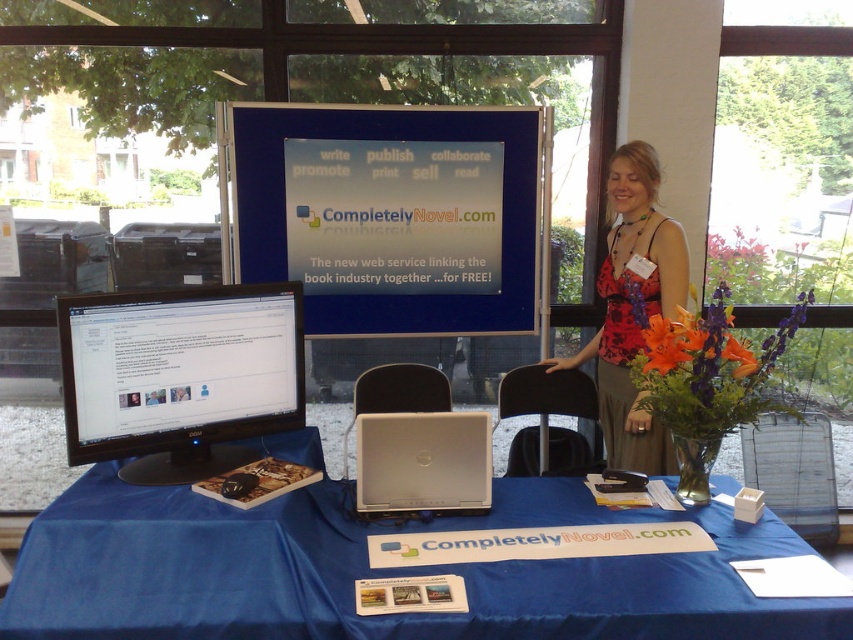
Question: Can you confirm if blue fabric table at center is wider than red floral dress at center?

Choices:
 (A) no
 (B) yes

Answer: (B)

Question: Is blue fabric table at center closer to the viewer compared to silver metallic laptop at center?

Choices:
 (A) yes
 (B) no

Answer: (A)

Question: Which point is closer to the camera taking this photo?

Choices:
 (A) (209, 627)
 (B) (252, 180)
 (C) (195, 365)
 (D) (368, 497)

Answer: (A)

Question: Which point appears farthest from the camera in this image?

Choices:
 (A) (146, 369)
 (B) (440, 419)
 (C) (672, 460)
 (D) (575, 570)

Answer: (C)

Question: Does blue fabric table at center have a smaller size compared to silver metallic laptop at center?

Choices:
 (A) yes
 (B) no

Answer: (B)

Question: Which object is closer to the camera taking this photo?

Choices:
 (A) black glossy monitor at left
 (B) blue plastic signboard at center
 (C) red floral dress at center

Answer: (A)